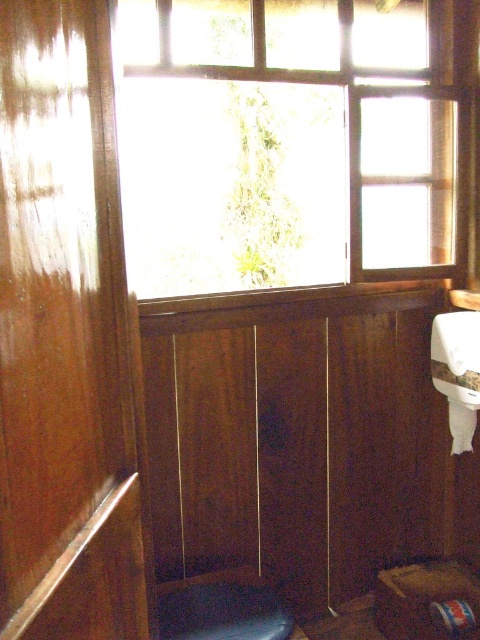
Question: Can you confirm if transparent glass window at upper center is smaller than dark blue fabric stool at lower center?

Choices:
 (A) yes
 (B) no

Answer: (B)

Question: Can you confirm if transparent glass window at upper center is bigger than dark blue fabric stool at lower center?

Choices:
 (A) no
 (B) yes

Answer: (B)

Question: Is the position of transparent glass window at upper center more distant than that of dark blue fabric stool at lower center?

Choices:
 (A) yes
 (B) no

Answer: (A)